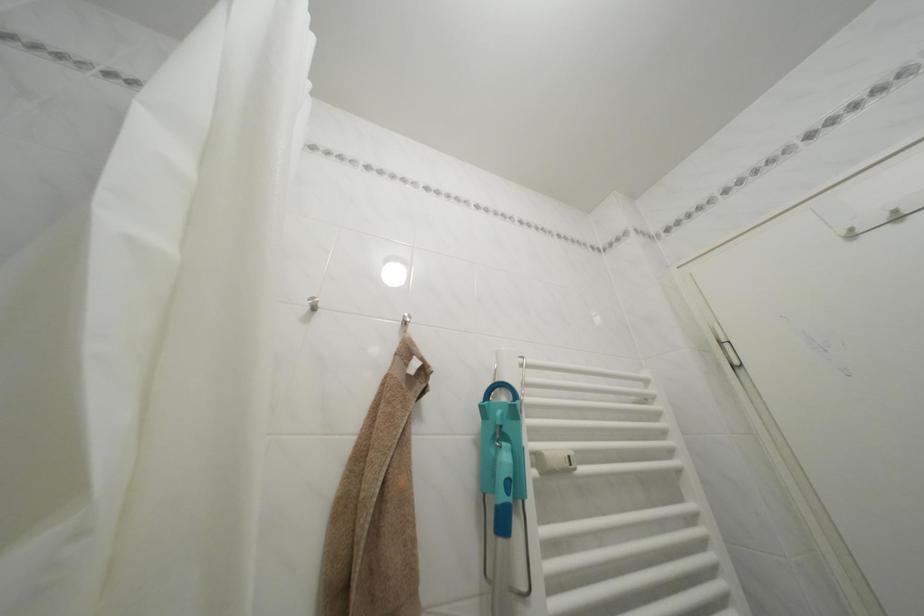
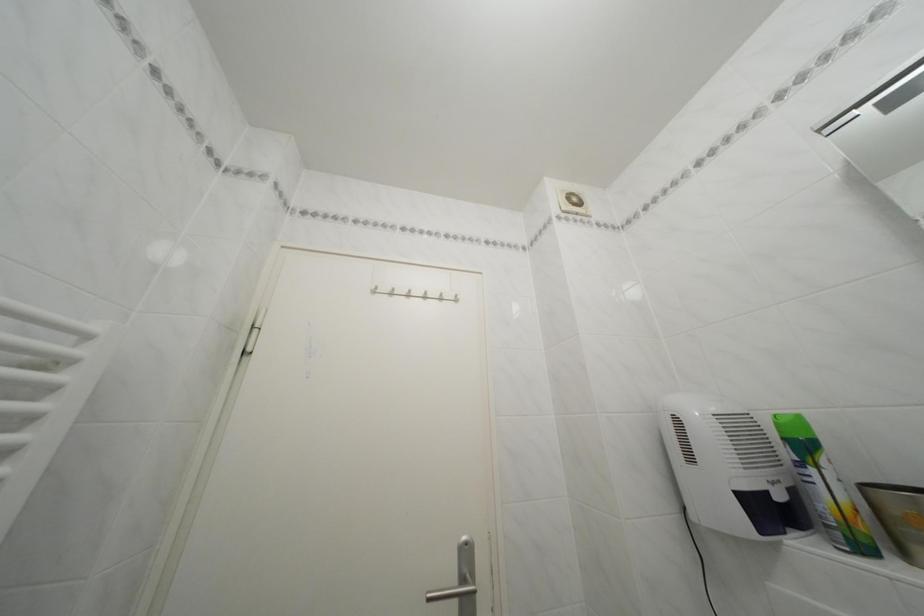
How did the camera likely rotate?

The camera rotated toward right-up.